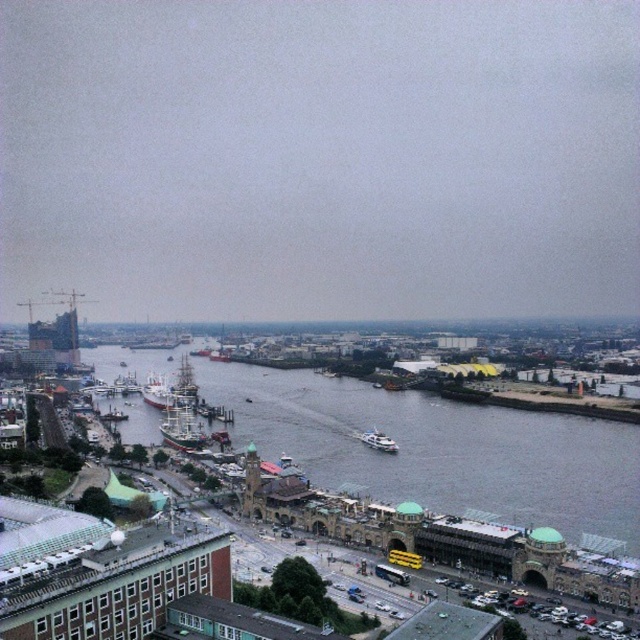
Where is `gray water at center`? The height and width of the screenshot is (640, 640). gray water at center is located at coordinates (438, 449).

Is gray water at center below white glossy boat at center?

Incorrect, gray water at center is not positioned below white glossy boat at center.

Image resolution: width=640 pixels, height=640 pixels. Identify the location of gray water at center. [x=438, y=449].

Find the location of a particular element. gray water at center is located at coordinates (438, 449).

Does gray water at center appear on the left side of green wooden ship at center?

In fact, gray water at center is to the right of green wooden ship at center.

Does point (252, 406) come closer to viewer compared to point (173, 442)?

No, it is not.

The height and width of the screenshot is (640, 640). What are the coordinates of `gray water at center` in the screenshot? It's located at (438, 449).

Is green wooden ship at center thinner than white glossy boat at center?

No.

Identify the location of green wooden ship at center. (180, 424).

What do you see at coordinates (180, 424) in the screenshot? This screenshot has height=640, width=640. I see `green wooden ship at center` at bounding box center [180, 424].

At what (x,y) coordinates should I click in order to perform the action: click on green wooden ship at center. Please return your answer as a coordinate pair (x, y). Looking at the image, I should click on (180, 424).